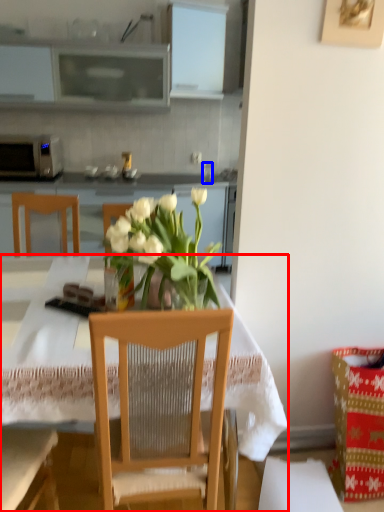
Question: Which point is closer to the camera, desk (highlighted by a red box) or coffee cup (highlighted by a blue box)?

Choices:
 (A) desk
 (B) coffee cup

Answer: (A)